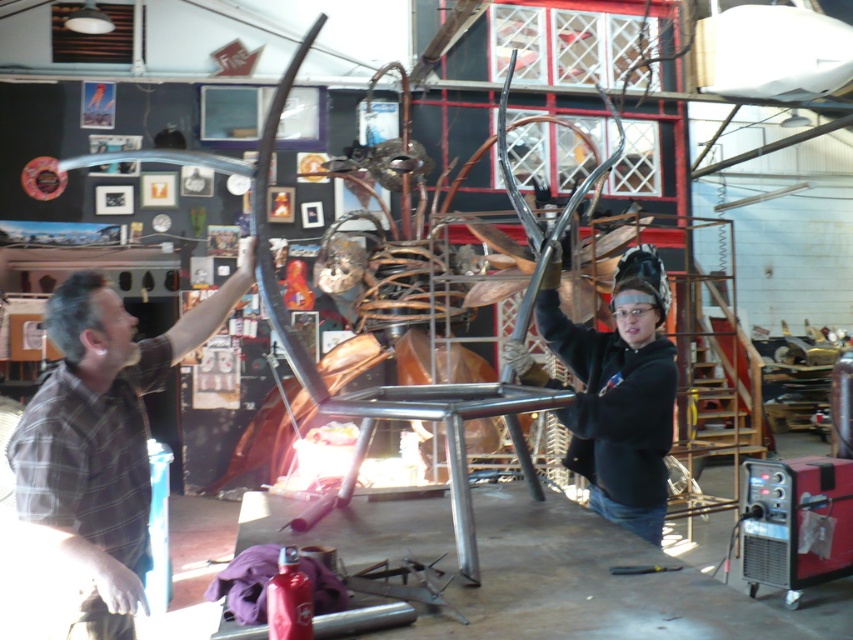
You are an assistant in the workshop and need to determine which object is wider between the brown plaid shirt at left and the black matte welding helmet at upper center. Based on the scene, which one is wider?

The brown plaid shirt at left is wider than the black matte welding helmet at upper center according to the description.

You are an assistant in the workshop and need to locate the welding helmet for the supervisor. The supervisor is currently wearing the brown plaid shirt at left. Where would you find the black matte welding helmet at upper center relative to the supervisor?

The black matte welding helmet at upper center is above the brown plaid shirt at left, so you can find it positioned higher up in the workspace above the supervisor.